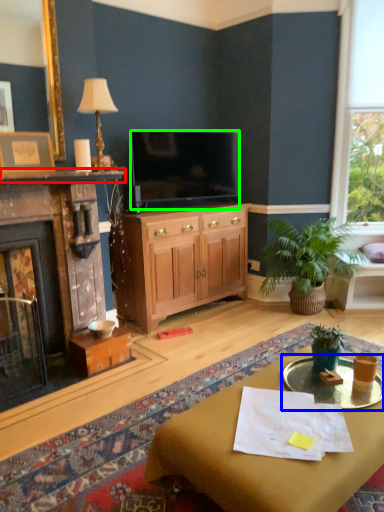
Question: Estimate the real-world distances between objects in this image. Which object is farther from mantle (highlighted by a red box), glass table (highlighted by a blue box) or television (highlighted by a green box)?

Choices:
 (A) glass table
 (B) television

Answer: (A)